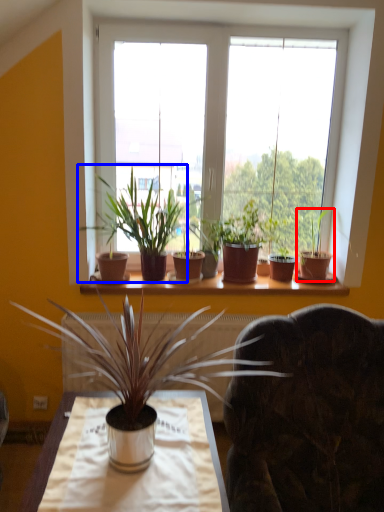
Question: Which of the following is the farthest to the observer, houseplant (highlighted by a red box) or houseplant (highlighted by a blue box)?

Choices:
 (A) houseplant
 (B) houseplant

Answer: (A)